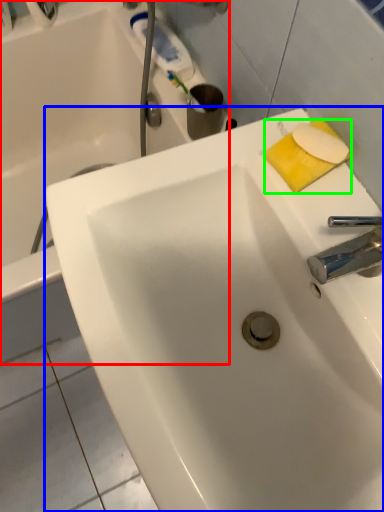
Question: Which object is positioned closest to bathtub (highlighted by a red box)? Select from sink (highlighted by a blue box) and soap (highlighted by a green box).

Choices:
 (A) sink
 (B) soap

Answer: (A)